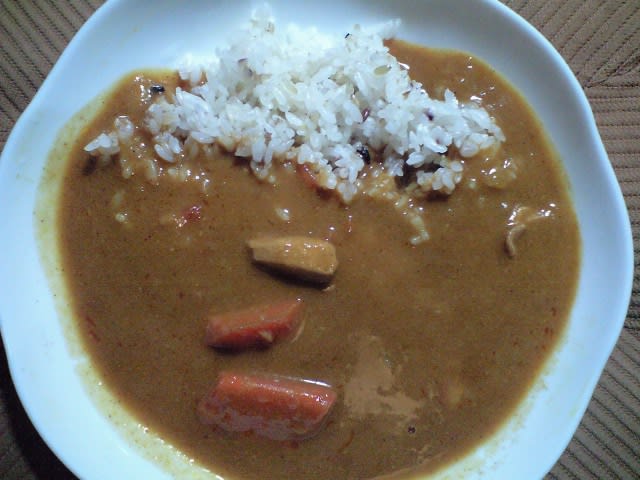
This screenshot has width=640, height=480. Identify the location of bowl. (557, 421).